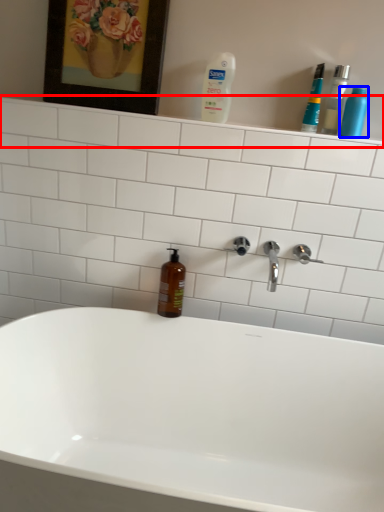
Question: Which of the following is the farthest to the observer, shelve (highlighted by a red box) or cleaning product (highlighted by a blue box)?

Choices:
 (A) shelve
 (B) cleaning product

Answer: (A)